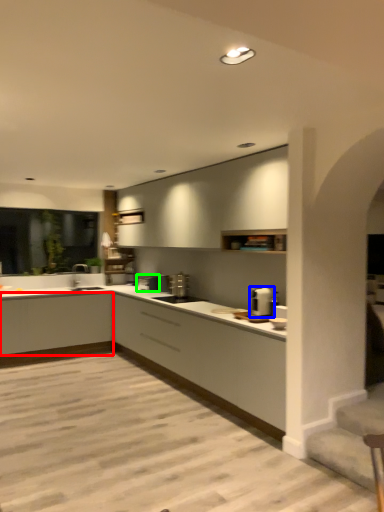
Question: Which object is the farthest from cabinetry (highlighted by a red box)? Choose among these: appliance (highlighted by a blue box) or appliance (highlighted by a green box).

Choices:
 (A) appliance
 (B) appliance

Answer: (A)